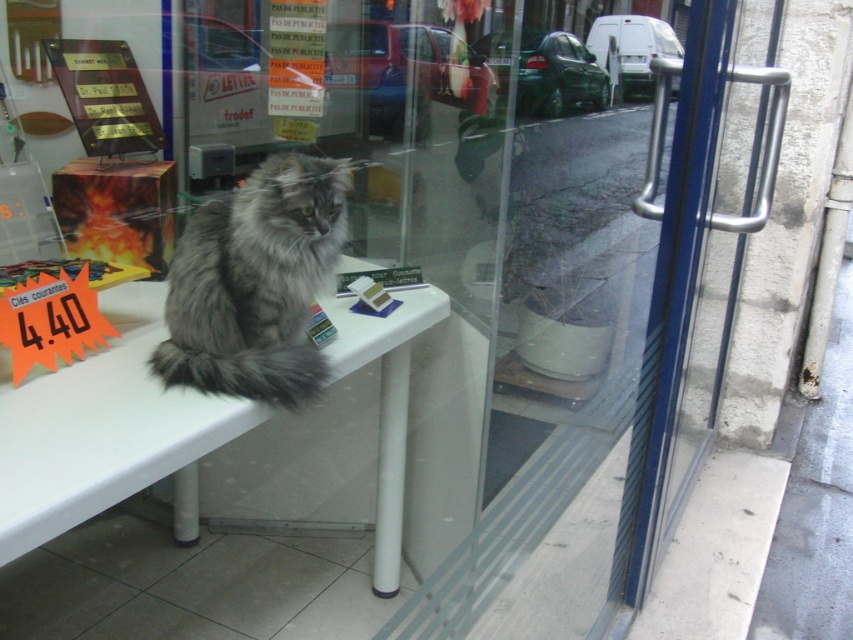
Does white plastic table at center have a greater height compared to fuzzy gray cat at center?

Yes, white plastic table at center is taller than fuzzy gray cat at center.

Between white plastic table at center and fuzzy gray cat at center, which one has less height?

With less height is fuzzy gray cat at center.

Does point (109, 436) lie behind point (231, 196)?

No.

Where is `white plastic table at center`? The height and width of the screenshot is (640, 853). white plastic table at center is located at coordinates (105, 435).